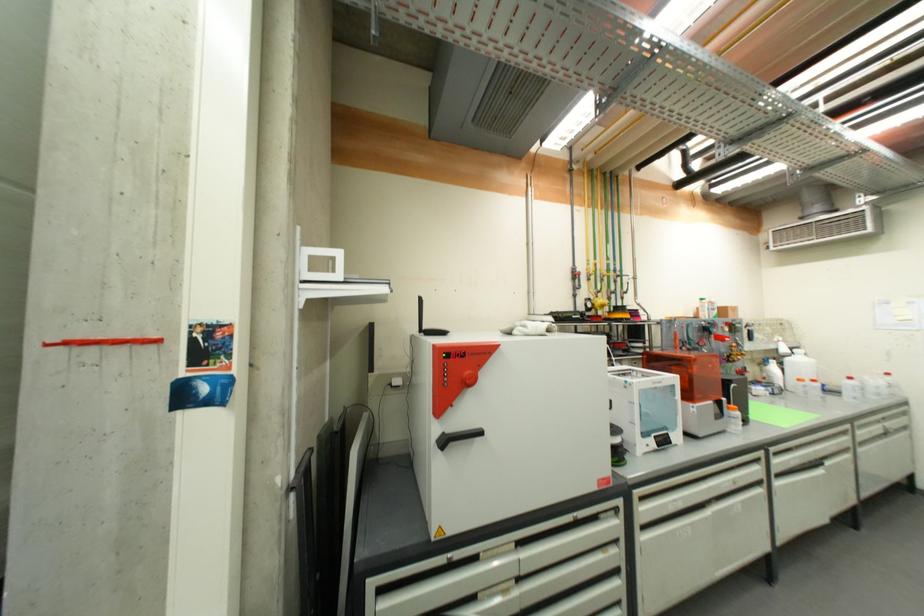
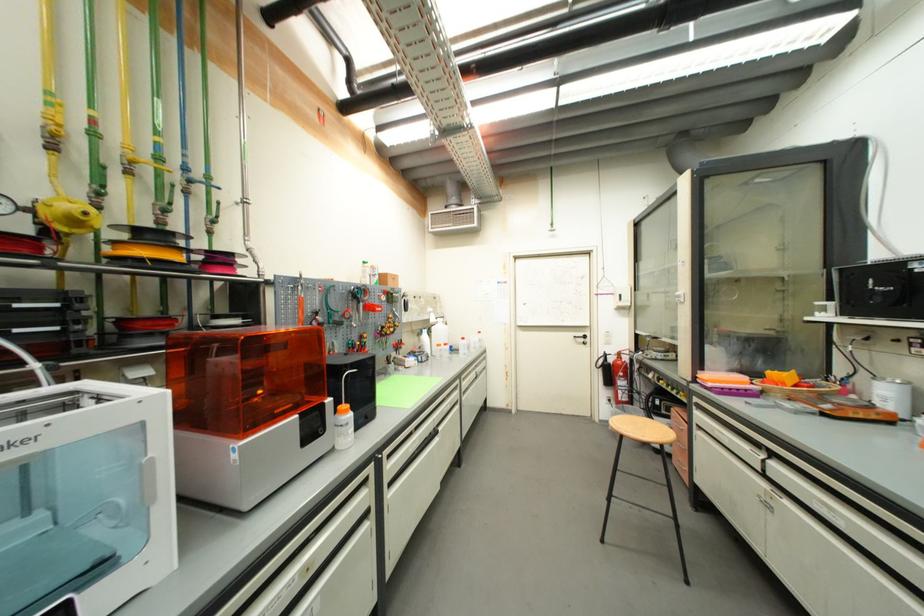
Find the pixel in the second image that matches (737,408) in the first image.

(349, 408)